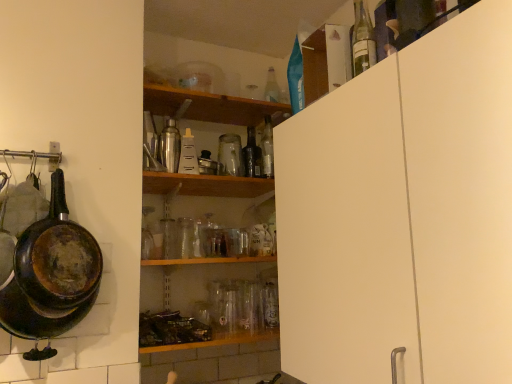
Question: Is black glass bottle at center, the 4th bottle when ordered from left to right, thinner than metallic silver shaker at center, which is counted as the 1th bottle, starting from the left?

Choices:
 (A) no
 (B) yes

Answer: (B)

Question: Considering the relative sizes of black glass bottle at center, arranged as the third bottle when viewed from the right, and metallic silver shaker at center, the fifth bottle viewed from the back, in the image provided, is black glass bottle at center, arranged as the third bottle when viewed from the right, taller than metallic silver shaker at center, the fifth bottle viewed from the back,?

Choices:
 (A) yes
 (B) no

Answer: (B)

Question: Is black glass bottle at center, arranged as the third bottle when viewed from the right, turned away from metallic silver shaker at center, the sixth bottle positioned from the right?

Choices:
 (A) no
 (B) yes

Answer: (A)

Question: Does black glass bottle at center, the 4th bottle when ordered from left to right, appear on the left side of metallic silver shaker at center, the sixth bottle positioned from the right?

Choices:
 (A) no
 (B) yes

Answer: (A)

Question: Is black glass bottle at center, acting as the fifth bottle starting from the front, at the right side of metallic silver shaker at center, positioned as the second bottle in front-to-back order?

Choices:
 (A) no
 (B) yes

Answer: (B)

Question: Is rusty cast iron frying pan at left taller or shorter than clear glass bottle at upper right, placed as the 1th bottle when sorted from front to back?

Choices:
 (A) short
 (B) tall

Answer: (B)

Question: Is rusty cast iron frying pan at left to the left or to the right of clear glass bottle at upper right, the 6th bottle from the left, in the image?

Choices:
 (A) left
 (B) right

Answer: (A)

Question: Considering their positions, is rusty cast iron frying pan at left located in front of or behind clear glass bottle at upper right, which is counted as the 6th bottle, starting from the back?

Choices:
 (A) behind
 (B) front

Answer: (A)

Question: From a real-world perspective, is rusty cast iron frying pan at left positioned above or below clear glass bottle at upper right, which appears as the 1th bottle when viewed from the right?

Choices:
 (A) below
 (B) above

Answer: (A)

Question: Is point (177, 150) closer or farther from the camera than point (322, 69)?

Choices:
 (A) farther
 (B) closer

Answer: (A)

Question: Considering their positions, is brushed metal shaker at upper center, which appears as the 2th bottle when viewed from the left, located in front of or behind clear plastic bottle at upper right?

Choices:
 (A) front
 (B) behind

Answer: (B)

Question: From their relative heights in the image, would you say brushed metal shaker at upper center, which appears as the 2th bottle when viewed from the left, is taller or shorter than clear plastic bottle at upper right?

Choices:
 (A) tall
 (B) short

Answer: (A)

Question: Looking at their shapes, would you say brushed metal shaker at upper center, the fifth bottle in the right-to-left sequence, is wider or thinner than clear plastic bottle at upper right?

Choices:
 (A) thin
 (B) wide

Answer: (A)

Question: Considering the relative positions of metallic silver shaker at center, the fifth bottle viewed from the back, and rusty cast iron frying pan at left in the image provided, is metallic silver shaker at center, the fifth bottle viewed from the back, to the left or to the right of rusty cast iron frying pan at left?

Choices:
 (A) right
 (B) left

Answer: (A)

Question: Would you say metallic silver shaker at center, positioned as the second bottle in front-to-back order, is inside or outside rusty cast iron frying pan at left?

Choices:
 (A) inside
 (B) outside

Answer: (B)